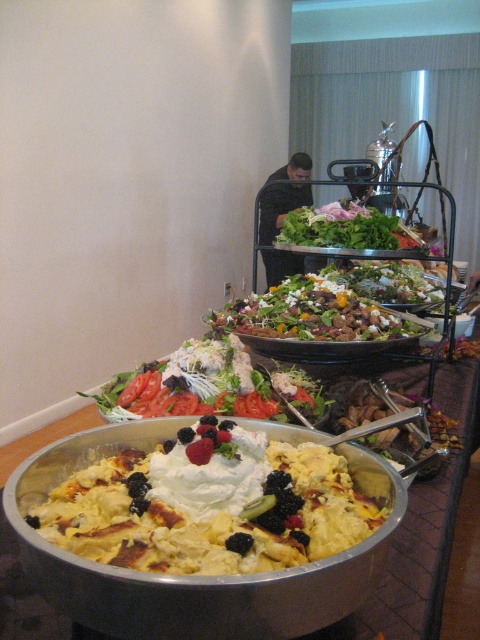
Question: Which point is farther from the camera taking this photo?

Choices:
 (A) (278, 323)
 (B) (132, 397)
 (C) (73, 456)

Answer: (A)

Question: Which of the following is the closest to the observer?

Choices:
 (A) green leafymaterial/textureobject at center
 (B) metallic silver bowl at center

Answer: (B)

Question: Is metallic silver bowl at center smaller than green leafy salad at center?

Choices:
 (A) no
 (B) yes

Answer: (B)

Question: Can you confirm if metallic silver bowl at center is positioned to the right of green leafymaterial/textureobject at center?

Choices:
 (A) yes
 (B) no

Answer: (B)

Question: Which point is farther to the camera?

Choices:
 (A) (297, 221)
 (B) (160, 392)
 (C) (232, 324)

Answer: (A)

Question: Where is metallic silver bowl at center located in relation to green leafymaterial/textureobject at center in the image?

Choices:
 (A) left
 (B) right

Answer: (A)